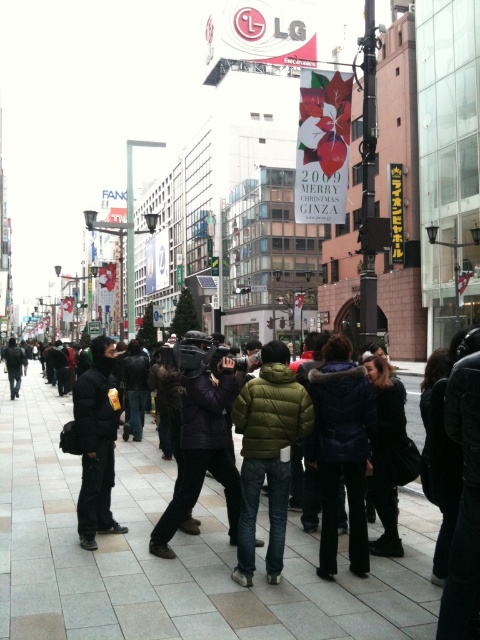
Question: Is green down jacket at center below velvet dark blue coat at center?

Choices:
 (A) no
 (B) yes

Answer: (B)

Question: Does gray concrete pavement at center have a greater width compared to velvet dark blue coat at center?

Choices:
 (A) yes
 (B) no

Answer: (A)

Question: Which point appears closest to the camera in this image?

Choices:
 (A) (251, 412)
 (B) (173, 470)

Answer: (A)

Question: Can you confirm if velvet dark blue coat at center is positioned below matte purple jacket at center?

Choices:
 (A) yes
 (B) no

Answer: (A)

Question: Among these points, which one is nearest to the camera?

Choices:
 (A) (371, 364)
 (B) (363, 566)

Answer: (B)

Question: Which point appears closest to the camera in this image?

Choices:
 (A) (255, 504)
 (B) (110, 472)

Answer: (A)